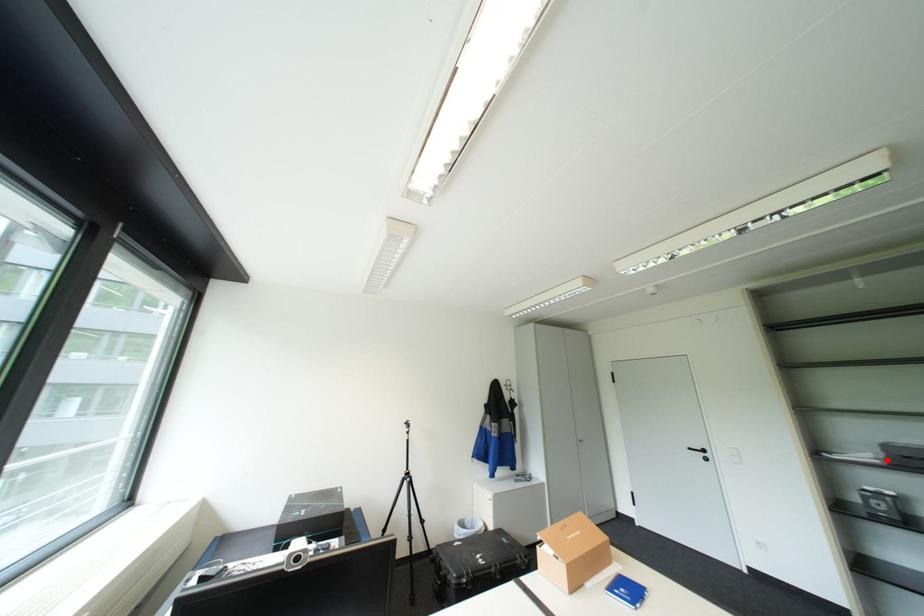
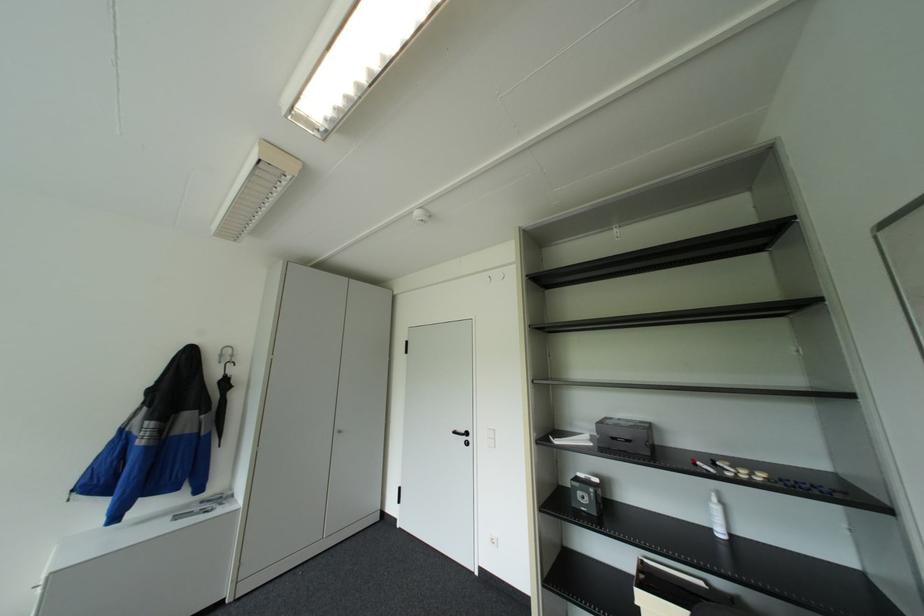
In the second image, find the point that corresponds to the highlighted location in the first image.

(600, 443)